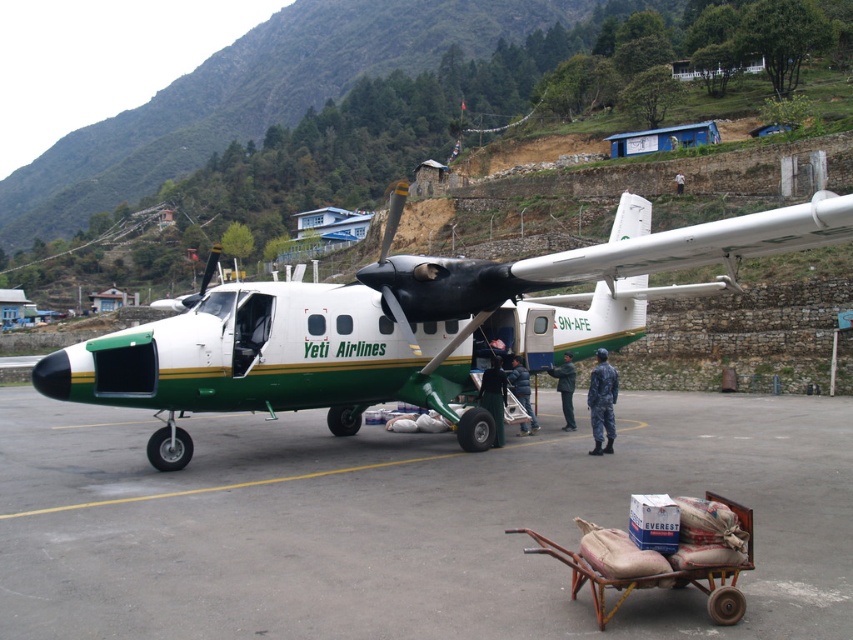
Question: Does dark green fabric jacket at center have a smaller size compared to dark blue jacket at center?

Choices:
 (A) no
 (B) yes

Answer: (B)

Question: Which object is the closest to the white matte airplane at center?

Choices:
 (A) dark blue jacket at center
 (B) rusty metal cart at lower center

Answer: (A)

Question: Is dark green fabric jacket at center to the right of white fabric shirt at center from the viewer's perspective?

Choices:
 (A) yes
 (B) no

Answer: (B)

Question: Which object appears closest to the camera in this image?

Choices:
 (A) smooth concrete tarmac at center
 (B) white fabric shirt at center

Answer: (A)

Question: Which of these objects is positioned farthest from the white fabric shirt at center?

Choices:
 (A) smooth concrete tarmac at center
 (B) white matte airplane at center
 (C) dark blue jacket at center

Answer: (A)

Question: Does dark blue uniform at center have a larger size compared to dark blue jacket at center?

Choices:
 (A) yes
 (B) no

Answer: (B)